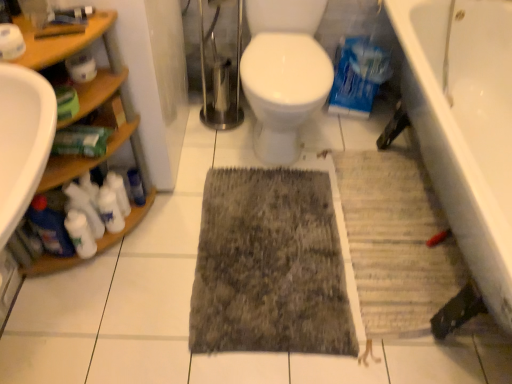
This screenshot has width=512, height=384. In order to click on free space above dark gray textured rug at center (from a real-world perspective) in this screenshot , I will do `click(273, 247)`.